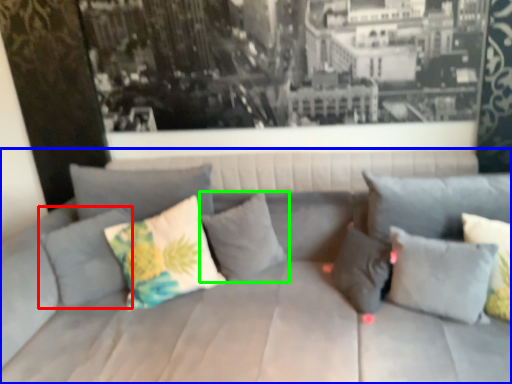
Question: Which is farther away from pillow (highlighted by a red box)? studio couch (highlighted by a blue box) or pillow (highlighted by a green box)?

Choices:
 (A) studio couch
 (B) pillow

Answer: (B)